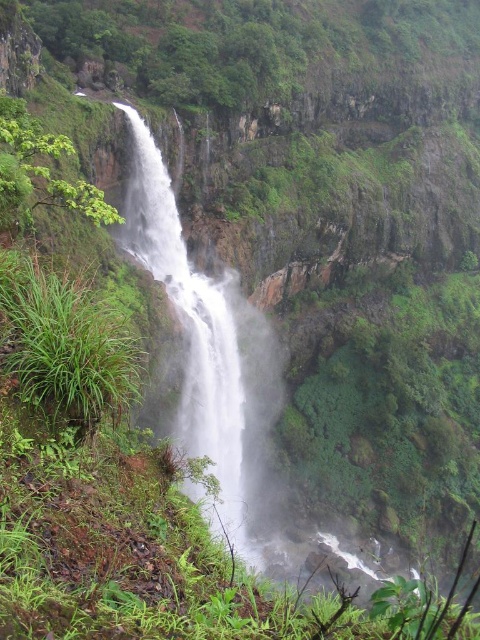
You are a photographer planning to capture the green leafy vegetation at upper center and the white misty waterfall at center in a single shot. Based on their positions, which object should you focus on first to ensure both are in frame?

The green leafy vegetation at upper center is positioned over the white misty waterfall at center, so you should focus on the green leafy vegetation at upper center first to ensure both are in frame.

You are standing at the base of the cliff and see the white misty waterfall at center and the green leafy plant at left. Which object is closer to your left side?

The green leafy plant at left is closer to your left side because it is positioned to the left of the white misty waterfall at center.

You are a hiker standing at the base of the cliff and want to take a photo of the white misty waterfall at center. To include the green leafy vegetation at upper center in your shot, should you pan your camera to the left or the right?

The green leafy vegetation at upper center is to the right of white misty waterfall at center, so you should pan your camera to the right to include it in your photo.